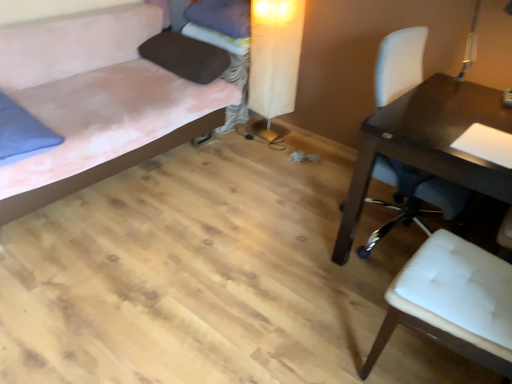
This screenshot has height=384, width=512. Find the location of `vacant space in white leather chair at right, which is counted as the 2th chair, starting from the back (from a real-world perspective)`. vacant space in white leather chair at right, which is counted as the 2th chair, starting from the back (from a real-world perspective) is located at coordinates (425, 364).